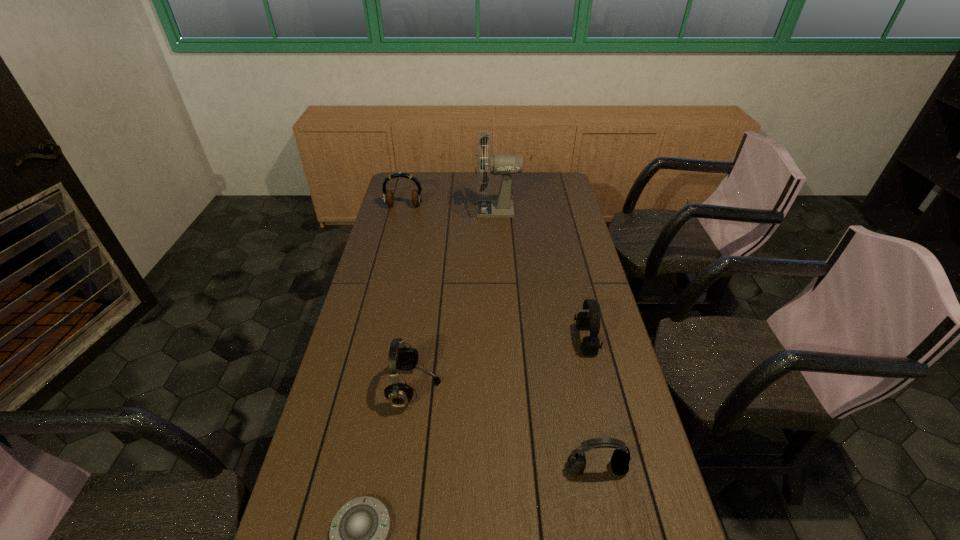
In the image, there is a desktop. Where is `blank space at the right edge`? blank space at the right edge is located at coordinates pyautogui.click(x=541, y=211).

At what (x,y) coordinates should I click in order to perform the action: click on vacant space at the far right corner. Please return your answer as a coordinate pair (x, y). This screenshot has width=960, height=540. Looking at the image, I should click on (540, 174).

Locate an element on the screen. The width and height of the screenshot is (960, 540). empty space between the third farthest headset and the second farthest headset is located at coordinates (500, 364).

The width and height of the screenshot is (960, 540). Identify the location of vacant region between the third farthest headset and the farthest headset. (410, 297).

This screenshot has width=960, height=540. In order to click on empty space between the fourth farthest object and the shortest headset in this screenshot , I will do `click(506, 428)`.

Find the location of a particular element. vacant space that's between the third farthest object and the fan is located at coordinates coord(541,275).

Where is `empty location between the third object from right to left and the shortest headset`? empty location between the third object from right to left and the shortest headset is located at coordinates (547, 339).

You are a GUI agent. You are given a task and a screenshot of the screen. Output one action in this format:
    pyautogui.click(x=<x>, y=<y>)
    Task: Click on the vacant area that lies between the shortest headset and the fan
    
    Given the screenshot: What is the action you would take?
    pyautogui.click(x=547, y=339)

This screenshot has width=960, height=540. What are the coordinates of `free spot between the fan and the farthest headset` in the screenshot? It's located at (450, 208).

The height and width of the screenshot is (540, 960). What are the coordinates of `vacant point located between the second nearest object and the farthest headset` in the screenshot? It's located at (500, 338).